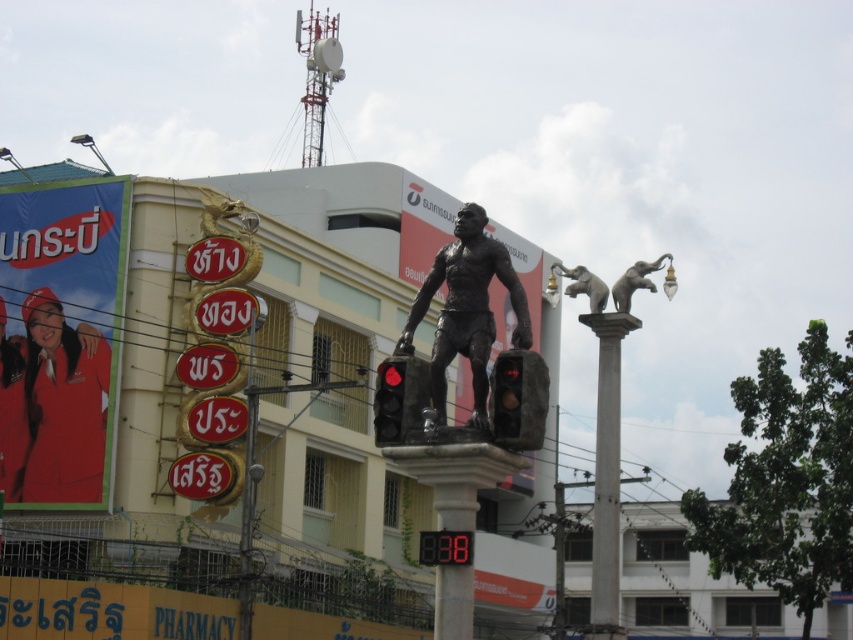
Question: From the image, what is the correct spatial relationship of gray concrete column at center in relation to metallic traffic light at center?

Choices:
 (A) left
 (B) right

Answer: (B)

Question: Which point is farther from the camera taking this photo?

Choices:
 (A) (495, 444)
 (B) (593, 579)
 (C) (395, 381)

Answer: (B)

Question: Does bronze statue at center have a greater width compared to gray metallic elephant at upper right?

Choices:
 (A) no
 (B) yes

Answer: (B)

Question: Which object appears farthest from the camera in this image?

Choices:
 (A) gray metallic elephant at upper right
 (B) gray concrete column at center

Answer: (A)

Question: Does gray concrete column at center lie in front of metallic traffic light at center?

Choices:
 (A) no
 (B) yes

Answer: (A)

Question: Which of the following is the closest to the observer?

Choices:
 (A) metallic traffic light at center
 (B) gray concrete column at center
 (C) bronze statue at center
 (D) gray metallic elephant at upper right

Answer: (C)